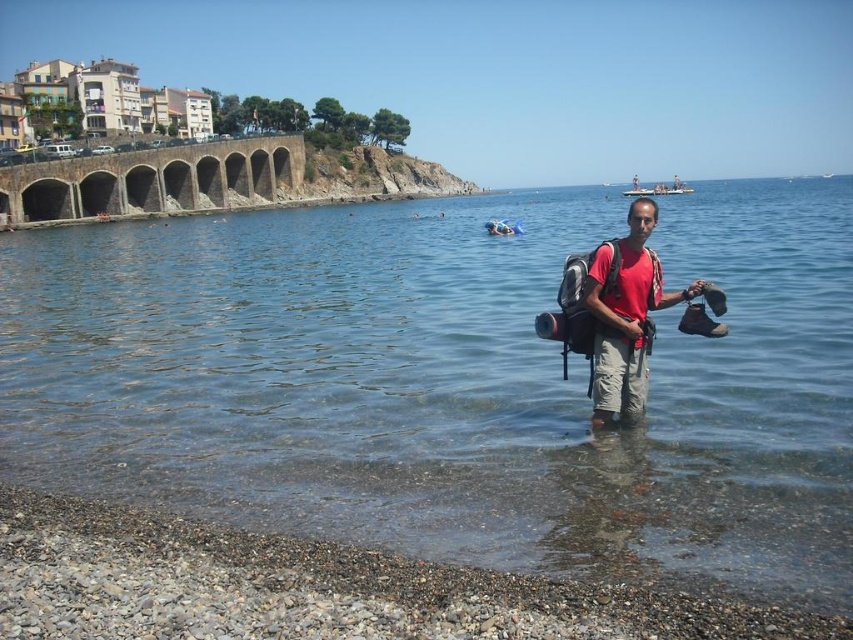
Question: Can you confirm if clear blue water at center is wider than matte red t-shirt at center?

Choices:
 (A) yes
 (B) no

Answer: (A)

Question: Observing the image, what is the correct spatial positioning of clear blue water at center in reference to matte red t-shirt at center?

Choices:
 (A) right
 (B) left

Answer: (A)

Question: Is smooth pebbles at lower left positioned at the back of matte red t-shirt at center?

Choices:
 (A) yes
 (B) no

Answer: (B)

Question: Which object is farther from the camera taking this photo?

Choices:
 (A) clear blue water at center
 (B) smooth pebbles at lower left

Answer: (A)

Question: Based on their relative distances, which object is nearer to the smooth pebbles at lower left?

Choices:
 (A) clear blue water at center
 (B) matte red t-shirt at center

Answer: (B)

Question: Which point is farther to the camera?

Choices:
 (A) (589, 305)
 (B) (282, 211)

Answer: (B)